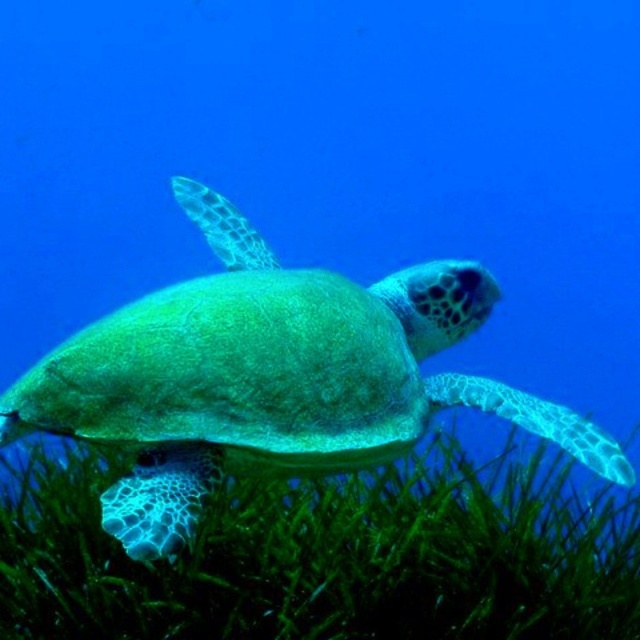
Based on the photo, does green leafy grass at lower center appear on the right side of green matte turtle at center?

In fact, green leafy grass at lower center is to the left of green matte turtle at center.

Does green leafy grass at lower center come in front of green matte turtle at center?

No, green leafy grass at lower center is behind green matte turtle at center.

What do you see at coordinates (326, 552) in the screenshot?
I see `green leafy grass at lower center` at bounding box center [326, 552].

This screenshot has height=640, width=640. What are the coordinates of `green leafy grass at lower center` in the screenshot? It's located at (326, 552).